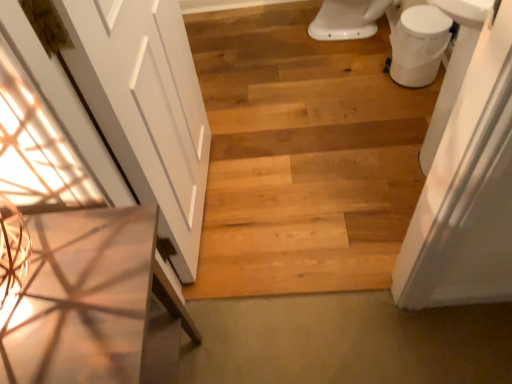
Question: Does white glossy toilet bowl at upper right appear on the right side of natural wood plank at center?

Choices:
 (A) no
 (B) yes

Answer: (B)

Question: From a real-world perspective, is white glossy toilet bowl at upper right physically below natural wood plank at center?

Choices:
 (A) no
 (B) yes

Answer: (A)

Question: Considering the relative sizes of white glossy toilet bowl at upper right and natural wood plank at center in the image provided, is white glossy toilet bowl at upper right smaller than natural wood plank at center?

Choices:
 (A) no
 (B) yes

Answer: (A)

Question: From the image's perspective, is white glossy toilet bowl at upper right below natural wood plank at center?

Choices:
 (A) no
 (B) yes

Answer: (A)

Question: Is white glossy toilet bowl at upper right not near natural wood plank at center?

Choices:
 (A) no
 (B) yes

Answer: (A)

Question: Considering the relative sizes of white glossy toilet bowl at upper right and natural wood plank at center in the image provided, is white glossy toilet bowl at upper right thinner than natural wood plank at center?

Choices:
 (A) no
 (B) yes

Answer: (A)

Question: Is white glossy toilet bowl at upper right turned away from white matte door at left?

Choices:
 (A) no
 (B) yes

Answer: (A)

Question: From a real-world perspective, does white glossy toilet bowl at upper right stand above white matte door at left?

Choices:
 (A) no
 (B) yes

Answer: (A)

Question: Is white glossy toilet bowl at upper right smaller than white matte door at left?

Choices:
 (A) yes
 (B) no

Answer: (A)

Question: Is white glossy toilet bowl at upper right thinner than white matte door at left?

Choices:
 (A) yes
 (B) no

Answer: (B)

Question: From the image's perspective, does white glossy toilet bowl at upper right appear lower than white matte door at left?

Choices:
 (A) no
 (B) yes

Answer: (A)

Question: Is white glossy toilet bowl at upper right facing towards white matte door at left?

Choices:
 (A) no
 (B) yes

Answer: (A)

Question: From the image's perspective, would you say natural wood plank at center is shown under white matte door at left?

Choices:
 (A) yes
 (B) no

Answer: (A)